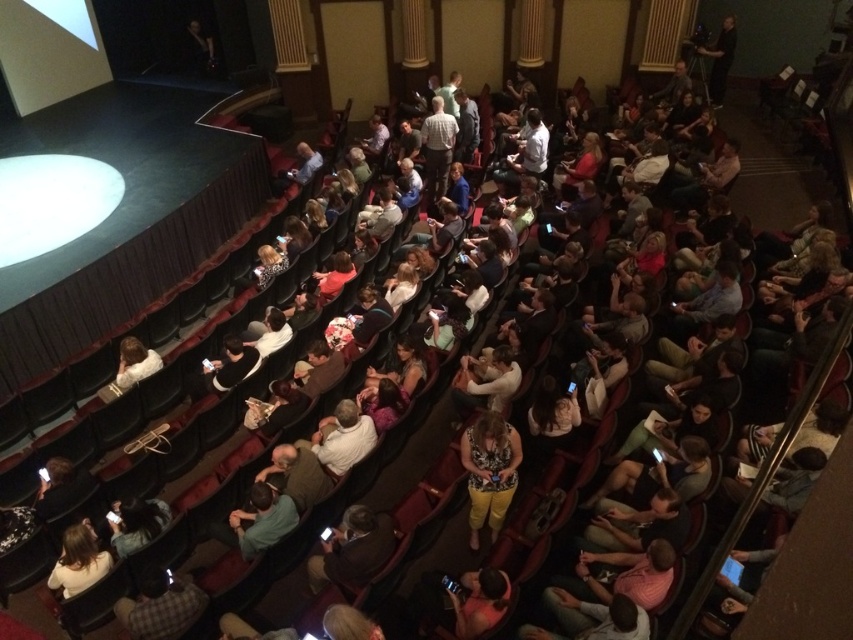
Is yellow cotton pants at center above dark brown leather jacket at center?

Indeed, yellow cotton pants at center is positioned over dark brown leather jacket at center.

Who is more distant from viewer, [492,424] or [341,561]?

The point [492,424] is more distant.

Identify the location of yellow cotton pants at center. Image resolution: width=853 pixels, height=640 pixels. (489, 470).